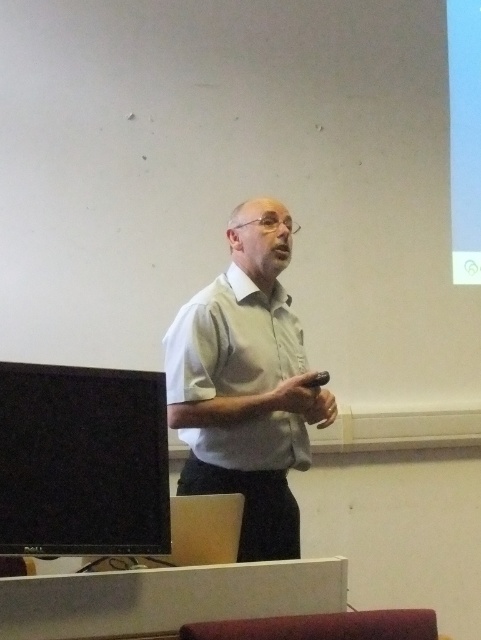
You are an attendee at the presentation. The presenter is wearing a light gray shirt at center and there is a black glossy monitor at left. Which object is taller?

The light gray shirt at center is taller than the black glossy monitor at left.

In the scene shown: You are an attendee at this presentation and need to determine the relative sizes of the objects in the scene. Based on the image, is the light gray shirt at center wider than the black glossy monitor at left?

The light gray shirt at center might be wider than black glossy monitor at left according to the description.

You are an attendee at the presentation. You want to see the presenter and the screen clearly. Which object is closer to you, the light gray shirt at center or the black glossy monitor at left?

The light gray shirt at center is closer to you because the black glossy monitor at left is behind it.